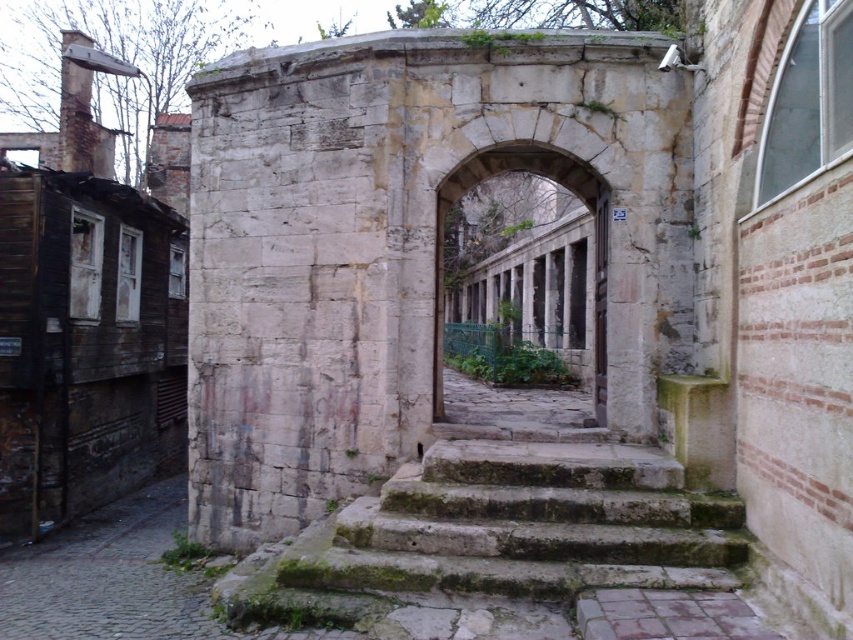
Measure the distance between green mossy stone stairs at center and stone archway at center.

A distance of 1.99 meters exists between green mossy stone stairs at center and stone archway at center.

Which is below, green mossy stone stairs at center or stone archway at center?

green mossy stone stairs at center is lower down.

Which is in front, point (643, 577) or point (599, 236)?

Point (643, 577)

Identify the location of green mossy stone stairs at center. (525, 524).